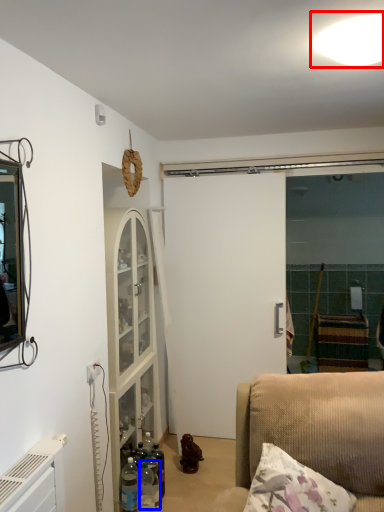
Question: Among these objects, which one is nearest to the camera, light (highlighted by a red box) or bottle (highlighted by a blue box)?

Choices:
 (A) light
 (B) bottle

Answer: (A)